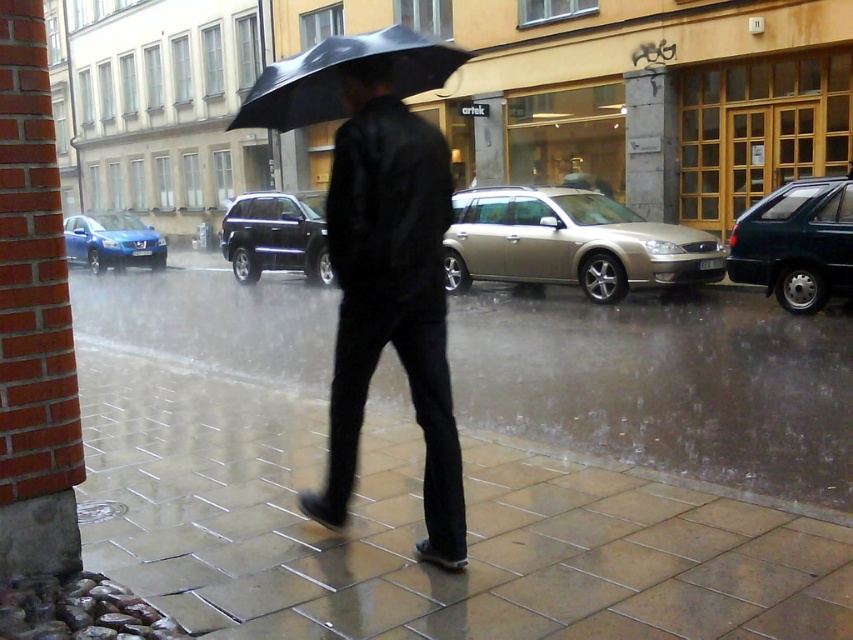
Question: Which object is the closest to the gold metallic station wagon at center?

Choices:
 (A) shiny black suv at center
 (B) blue metallic hatchback at left
 (C) black matte umbrella at center

Answer: (A)

Question: Among these objects, which one is nearest to the camera?

Choices:
 (A) shiny black suv at center
 (B) matte black jacket at center
 (C) gold metallic station wagon at center
 (D) blue metallic hatchback at left

Answer: (B)

Question: From the image, what is the correct spatial relationship of smooth stone pavement at center in relation to black matte umbrella at center?

Choices:
 (A) below
 (B) above

Answer: (A)

Question: Is matte black jacket at center bigger than blue metallic hatchback at left?

Choices:
 (A) no
 (B) yes

Answer: (A)

Question: Which object appears farthest from the camera in this image?

Choices:
 (A) blue metallic hatchback at left
 (B) gold metallic station wagon at center
 (C) matte black jacket at center
 (D) smooth stone pavement at center

Answer: (B)

Question: Does teal matte suv at right have a lesser width compared to blue metallic hatchback at left?

Choices:
 (A) no
 (B) yes

Answer: (B)